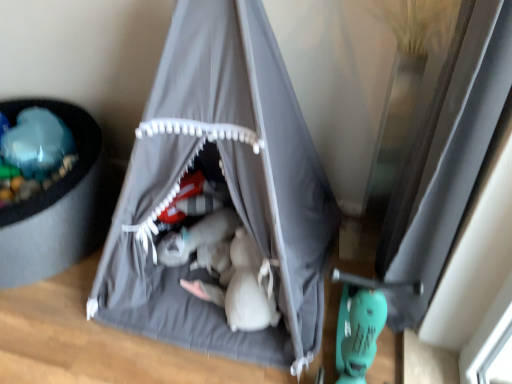
Question: Does point (304, 271) appear closer or farther from the camera than point (463, 243)?

Choices:
 (A) closer
 (B) farther

Answer: (B)

Question: Considering the positions of gray fabric tent at center and transparent glass window at right in the image, is gray fabric tent at center bigger or smaller than transparent glass window at right?

Choices:
 (A) small
 (B) big

Answer: (B)

Question: Choose the correct answer: Is gray fabric tent at center inside transparent glass window at right or outside it?

Choices:
 (A) inside
 (B) outside

Answer: (B)

Question: Relative to gray fabric tent at center, is transparent glass window at right in front or behind?

Choices:
 (A) behind
 (B) front

Answer: (A)

Question: Does point (461, 336) appear closer or farther from the camera than point (248, 340)?

Choices:
 (A) farther
 (B) closer

Answer: (B)

Question: In terms of size, does transparent glass window at right appear bigger or smaller than gray fabric tent at center?

Choices:
 (A) big
 (B) small

Answer: (B)

Question: From the image's perspective, relative to gray fabric tent at center, is transparent glass window at right above or below?

Choices:
 (A) below
 (B) above

Answer: (A)